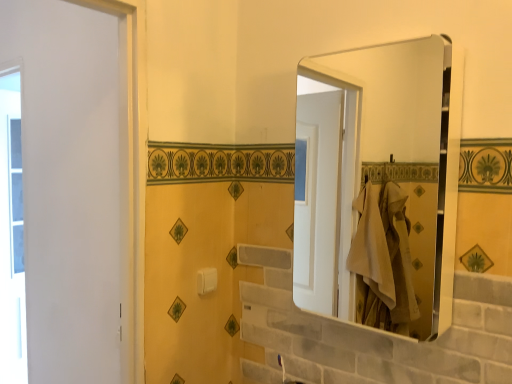
What do you see at coordinates (206, 280) in the screenshot? This screenshot has height=384, width=512. I see `white plastic towel bar at center` at bounding box center [206, 280].

Identify the location of transparent glass window at left. (12, 233).

What do you see at coordinates (404, 169) in the screenshot? This screenshot has width=512, height=384. I see `metallic silver mirror at upper right` at bounding box center [404, 169].

I want to click on metallic silver mirror at upper right, so click(404, 169).

What are the coordinates of `white plastic towel bar at center` in the screenshot? It's located at (206, 280).

Considering the positions of objects metallic silver mirror at upper right and transparent glass window at left in the image provided, who is in front, metallic silver mirror at upper right or transparent glass window at left?

metallic silver mirror at upper right is closer to the camera.

Between point (408, 170) and point (7, 223), which one is positioned behind?

The point (7, 223) is farther.

Is metallic silver mirror at upper right facing away from transparent glass window at left?

No, transparent glass window at left is not at the back of metallic silver mirror at upper right.

Choose the correct answer: Is transparent glass window at left inside metallic silver mirror at upper right or outside it?

transparent glass window at left exists outside the volume of metallic silver mirror at upper right.

Is transparent glass window at left taller or shorter than metallic silver mirror at upper right?

Clearly, transparent glass window at left is taller compared to metallic silver mirror at upper right.

From a real-world perspective, is transparent glass window at left above or below metallic silver mirror at upper right?

transparent glass window at left is situated lower than metallic silver mirror at upper right in the real world.

Is transparent glass window at left oriented away from metallic silver mirror at upper right?

No, transparent glass window at left is not facing away from metallic silver mirror at upper right.

The width and height of the screenshot is (512, 384). I want to click on window that is under the white plastic towel bar at center (from a real-world perspective), so click(12, 233).

From the image's perspective, which one is positioned lower, white plastic towel bar at center or transparent glass window at left?

From the image's view, transparent glass window at left is below.

Is white plastic towel bar at center facing away from transparent glass window at left?

Yes.

Looking at this image, from their relative heights in the image, would you say white plastic towel bar at center is taller or shorter than transparent glass window at left?

Clearly, white plastic towel bar at center is shorter compared to transparent glass window at left.

From the picture: Considering the positions of objects metallic silver mirror at upper right and white plastic towel bar at center in the image provided, who is in front, metallic silver mirror at upper right or white plastic towel bar at center?

metallic silver mirror at upper right is in front.

From a real-world perspective, is metallic silver mirror at upper right physically below white plastic towel bar at center?

No, from a real-world perspective, metallic silver mirror at upper right is not under white plastic towel bar at center.

Considering the positions of point (379, 144) and point (217, 276), is point (379, 144) closer or farther from the camera than point (217, 276)?

Point (379, 144) is positioned farther from the camera compared to point (217, 276).

Considering the relative sizes of metallic silver mirror at upper right and white plastic towel bar at center in the image provided, is metallic silver mirror at upper right shorter than white plastic towel bar at center?

No, metallic silver mirror at upper right is not shorter than white plastic towel bar at center.

From a real-world perspective, is white plastic towel bar at center above or below metallic silver mirror at upper right?

From a real-world perspective, white plastic towel bar at center is physically below metallic silver mirror at upper right.

Does white plastic towel bar at center turn towards metallic silver mirror at upper right?

No, white plastic towel bar at center is not aimed at metallic silver mirror at upper right.

From the image's perspective, which object appears higher, white plastic towel bar at center or metallic silver mirror at upper right?

metallic silver mirror at upper right is shown above in the image.

How many degrees apart are the facing directions of white plastic towel bar at center and metallic silver mirror at upper right?

90 degrees.

Does point (17, 254) lie in front of point (213, 274)?

No, it is behind (213, 274).

Can you confirm if transparent glass window at left is thinner than white plastic towel bar at center?

Incorrect, the width of transparent glass window at left is not less than that of white plastic towel bar at center.

Is transparent glass window at left in contact with white plastic towel bar at center?

transparent glass window at left and white plastic towel bar at center are not in contact.

You are a GUI agent. You are given a task and a screenshot of the screen. Output one action in this format:
    pyautogui.click(x=<x>, y=<y>)
    Task: Click on the window behind the metallic silver mirror at upper right
    The image size is (512, 384).
    Given the screenshot: What is the action you would take?
    (x=12, y=233)

Identify the location of mirror on the right side of transparent glass window at left. Image resolution: width=512 pixels, height=384 pixels. (404, 169).

When comparing their distances from white plastic towel bar at center, does metallic silver mirror at upper right or transparent glass window at left seem further?

Based on the image, transparent glass window at left appears to be further to white plastic towel bar at center.

From the image, which object appears to be farther from metallic silver mirror at upper right, transparent glass window at left or white plastic towel bar at center?

transparent glass window at left is positioned further to the anchor metallic silver mirror at upper right.

From the image, which object appears to be nearer to transparent glass window at left, white plastic towel bar at center or metallic silver mirror at upper right?

white plastic towel bar at center lies closer to transparent glass window at left than the other object.

Based on their spatial positions, is white plastic towel bar at center or transparent glass window at left closer to metallic silver mirror at upper right?

The object closer to metallic silver mirror at upper right is white plastic towel bar at center.

Considering their positions, is metallic silver mirror at upper right positioned further to transparent glass window at left than white plastic towel bar at center?

Based on the image, metallic silver mirror at upper right appears to be further to transparent glass window at left.

Estimate the real-world distances between objects in this image. Which object is further from white plastic towel bar at center, transparent glass window at left or metallic silver mirror at upper right?

transparent glass window at left.

The image size is (512, 384). I want to click on towel bar between transparent glass window at left and metallic silver mirror at upper right from left to right, so click(x=206, y=280).